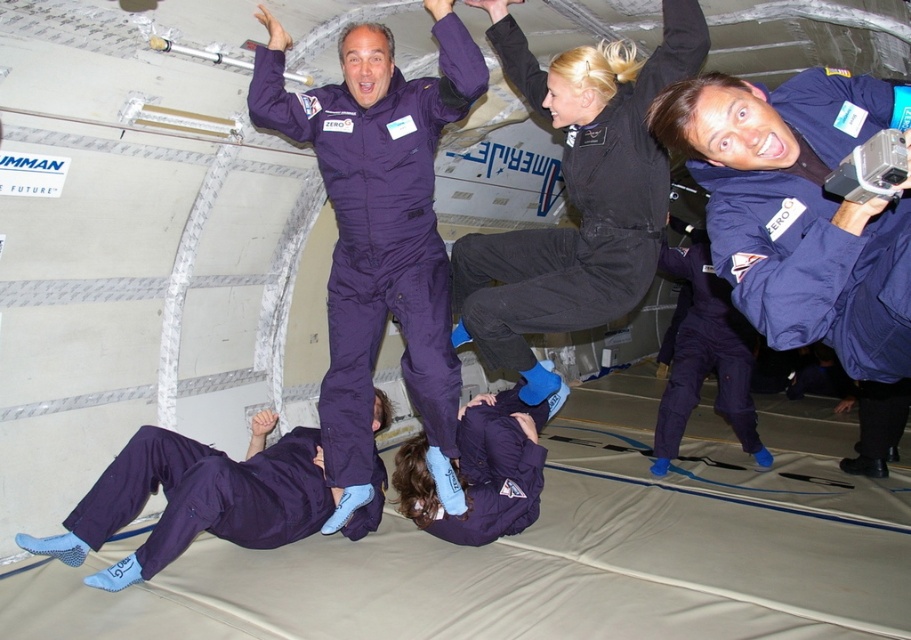
Measure the distance between purple smooth jumpsuit at upper center and camera.

They are 6.62 feet apart.

Based on the photo, is purple smooth jumpsuit at upper center in front of black smooth jumpsuit at upper center?

No.

Identify the location of purple smooth jumpsuit at upper center. This screenshot has height=640, width=911. (379, 232).

What do you see at coordinates (379, 232) in the screenshot? The image size is (911, 640). I see `purple smooth jumpsuit at upper center` at bounding box center [379, 232].

Does point (346, 337) come in front of point (677, 417)?

Yes, it is.

Find the location of a particular element. The width and height of the screenshot is (911, 640). purple smooth jumpsuit at upper center is located at coordinates (379, 232).

Who is higher up, matte blue jumpsuit at center or matte blue jumpsuit at upper right?

matte blue jumpsuit at center is higher up.

This screenshot has width=911, height=640. What do you see at coordinates (805, 225) in the screenshot?
I see `matte blue jumpsuit at center` at bounding box center [805, 225].

In order to click on matte blue jumpsuit at center in this screenshot , I will do `click(805, 225)`.